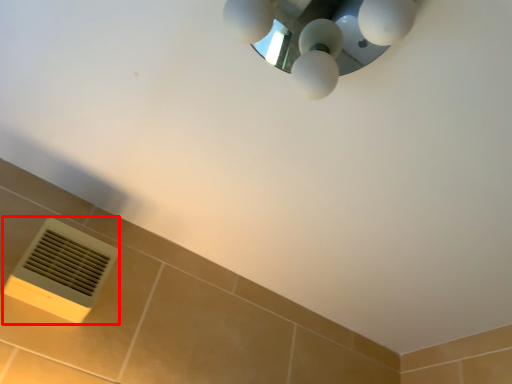
Question: Considering the relative positions of air conditioning (annotated by the red box) and lamp in the image provided, where is air conditioning (annotated by the red box) located with respect to the staircase?

Choices:
 (A) right
 (B) left

Answer: (B)